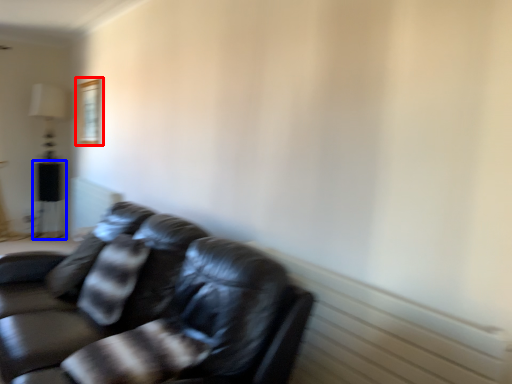
Question: Which object is further to the camera taking this photo, picture frame (highlighted by a red box) or table (highlighted by a blue box)?

Choices:
 (A) picture frame
 (B) table

Answer: (B)